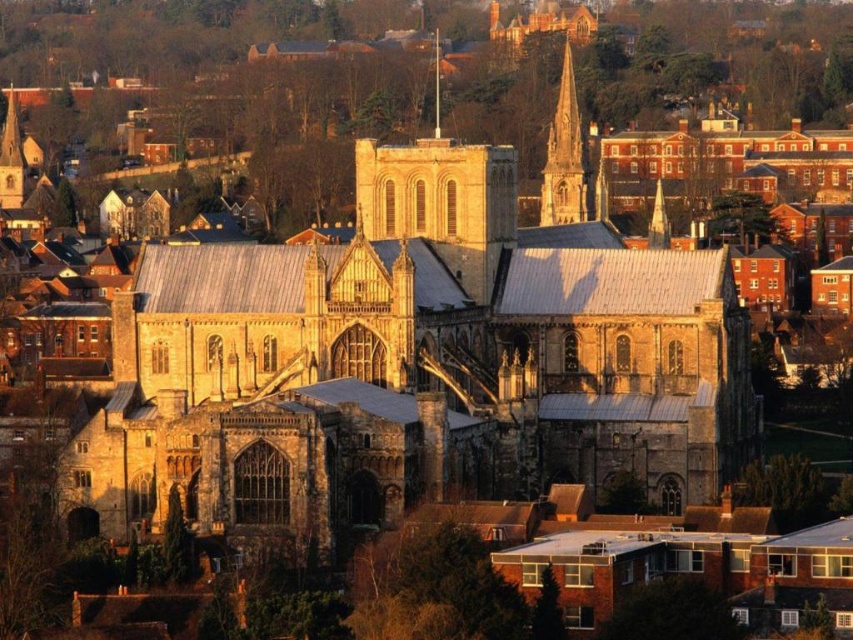
Question: Which point appears closest to the camera in this image?

Choices:
 (A) (563, 212)
 (B) (106, 515)

Answer: (B)

Question: Can you confirm if stone church at center is thinner than smooth stone spire at upper center?

Choices:
 (A) yes
 (B) no

Answer: (B)

Question: Does stone church at center have a lesser width compared to smooth stone spire at upper center?

Choices:
 (A) no
 (B) yes

Answer: (A)

Question: Which point is closer to the camera?

Choices:
 (A) smooth stone spire at upper center
 (B) stone church at center

Answer: (B)

Question: Can you confirm if stone church at center is positioned to the left of smooth stone spire at upper center?

Choices:
 (A) no
 (B) yes

Answer: (B)